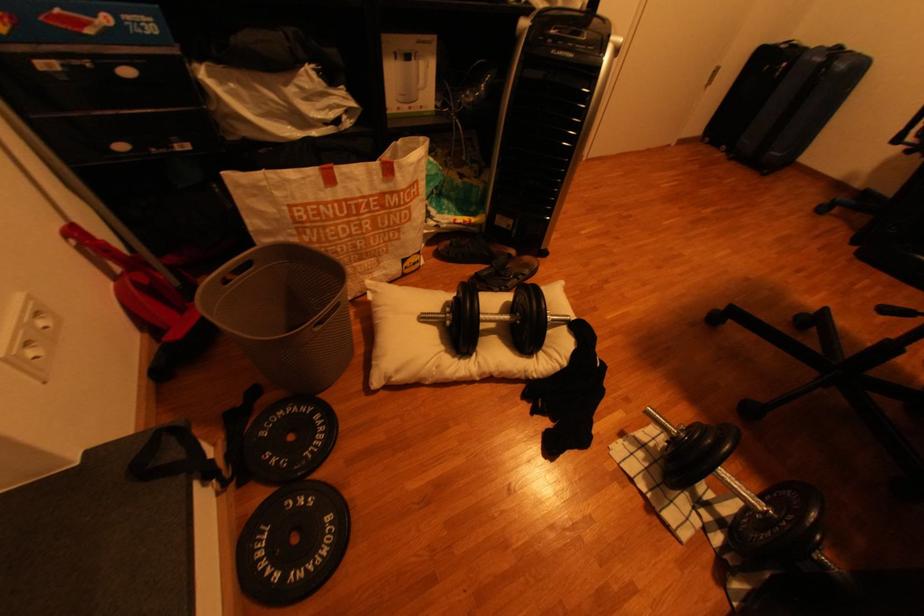
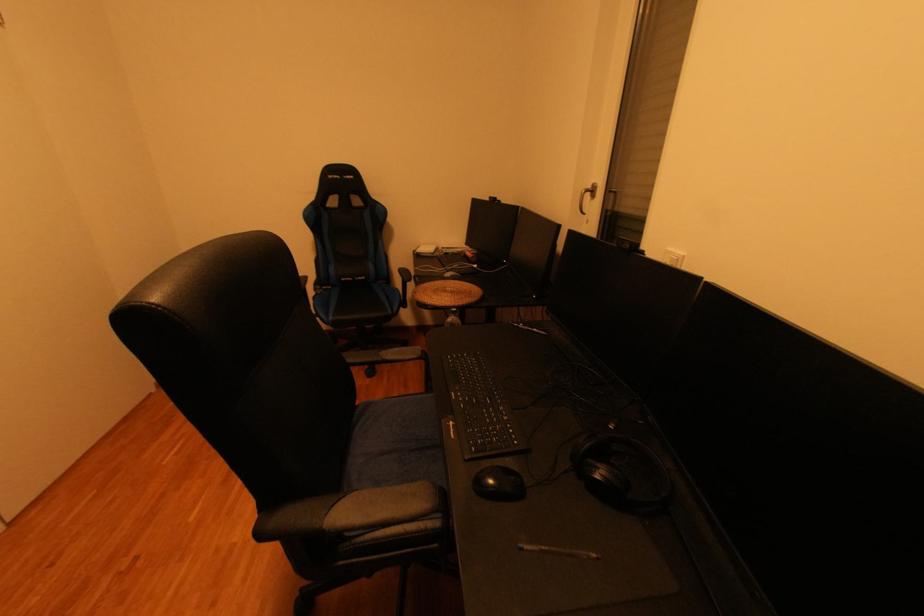
Question: The camera is either moving clockwise (left) or counter-clockwise (right) around the object. The first image is from the beginning of the video and the second image is from the end. Is the camera moving left or right when shooting the video?

Choices:
 (A) Left
 (B) Right

Answer: (A)